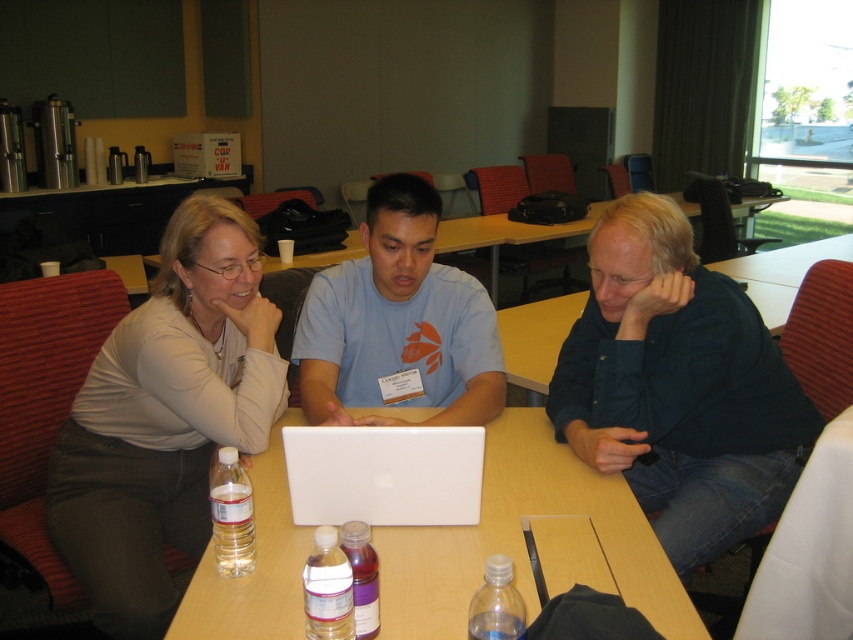
Can you confirm if matte beige sweater at center is thinner than white matte laptop at center?

No, matte beige sweater at center is not thinner than white matte laptop at center.

Who is more distant from viewer, (x=131, y=557) or (x=461, y=499)?

The point (x=131, y=557) is more distant.

Where is `matte beige sweater at center`? The width and height of the screenshot is (853, 640). matte beige sweater at center is located at coordinates (165, 417).

Where is `matte beige sweater at center`? The height and width of the screenshot is (640, 853). matte beige sweater at center is located at coordinates (165, 417).

Does point (228, 316) come behind point (529, 352)?

No.

Based on the photo, between matte beige sweater at center and wooden table at center, which one is positioned lower?

matte beige sweater at center is below.

Does point (115, 563) come behind point (724, 266)?

No, (115, 563) is in front of (724, 266).

Image resolution: width=853 pixels, height=640 pixels. What are the coordinates of `matte beige sweater at center` in the screenshot? It's located at (165, 417).

In the scene shown: Is dark blue shirt at center taller than matte beige sweater at center?

No, dark blue shirt at center is not taller than matte beige sweater at center.

Between point (693, 484) and point (175, 218), which one is positioned behind?

Positioned behind is point (693, 484).

Find the location of a particular element. This screenshot has width=853, height=640. dark blue shirt at center is located at coordinates (677, 387).